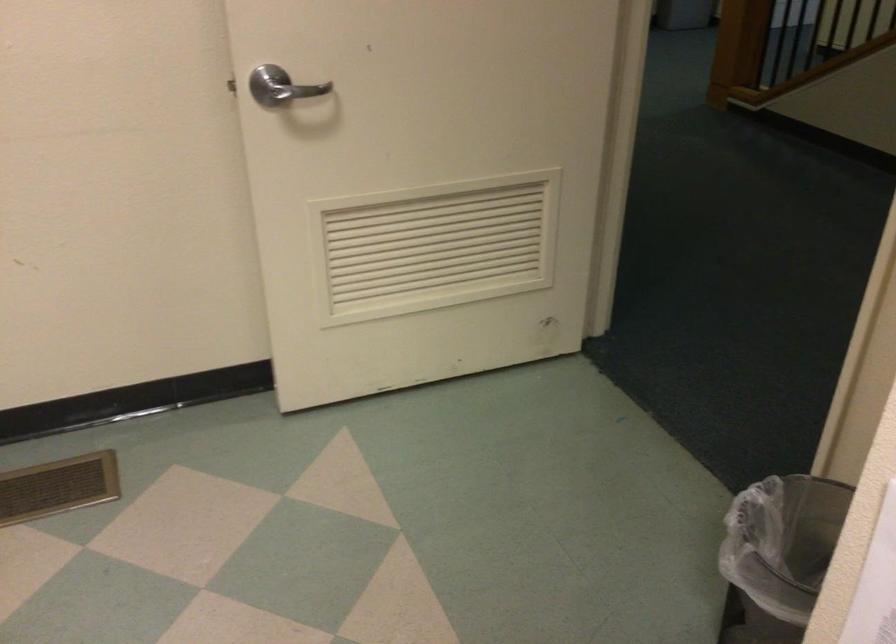
What do you see at coordinates (270, 86) in the screenshot?
I see `the silver door handle` at bounding box center [270, 86].